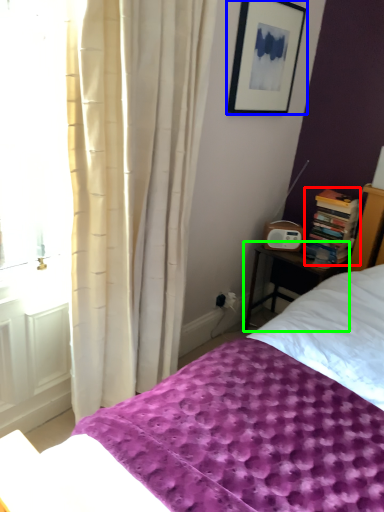
Question: Which object is positioned closest to book (highlighted by a red box)? Select from picture frame (highlighted by a blue box) and nightstand (highlighted by a green box).

Choices:
 (A) picture frame
 (B) nightstand

Answer: (B)